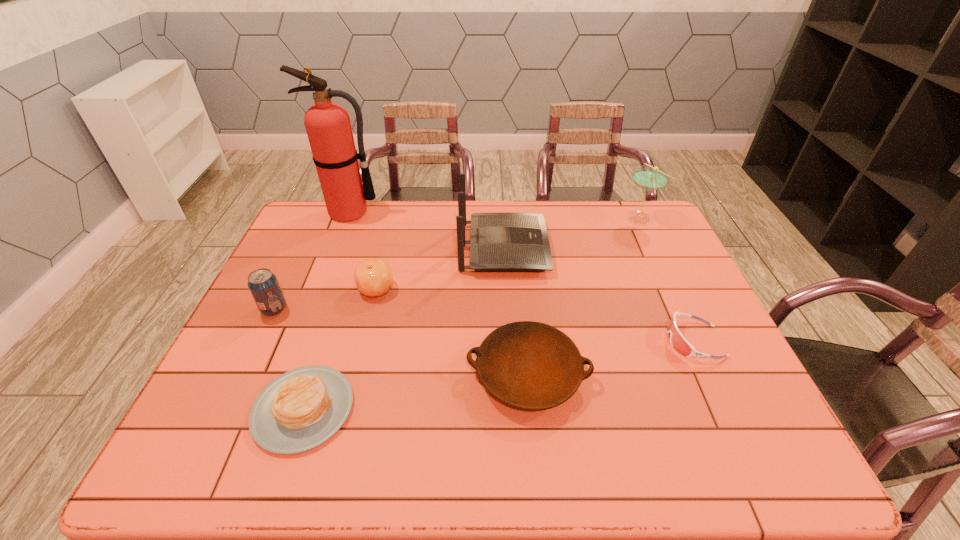
Locate an element on the screen. blank space located 0.140m on the left of the martini is located at coordinates (582, 218).

Where is `vacant space located on the back of the pop soda`? The width and height of the screenshot is (960, 540). vacant space located on the back of the pop soda is located at coordinates (308, 238).

The width and height of the screenshot is (960, 540). I want to click on free space located on the back of the fourth shortest object, so pyautogui.click(x=386, y=248).

Where is `vacant space located 0.180m on the right of the plate`? The height and width of the screenshot is (540, 960). vacant space located 0.180m on the right of the plate is located at coordinates (664, 374).

Identify the location of vacant region located on the front-facing side of the goggles. Image resolution: width=960 pixels, height=540 pixels. (623, 341).

In order to click on vacant space situated 0.100m on the front-facing side of the goggles in this screenshot , I will do `click(627, 341)`.

Locate an element on the screen. This screenshot has height=540, width=960. vacant space situated 0.120m on the front-facing side of the goggles is located at coordinates (619, 341).

Locate an element on the screen. The height and width of the screenshot is (540, 960). vacant space situated on the back of the pancake is located at coordinates (334, 316).

I want to click on fire extinguisher positioned at the far edge, so click(x=328, y=126).

Image resolution: width=960 pixels, height=540 pixels. What are the coordinates of `router that is at the far edge` in the screenshot? It's located at (499, 242).